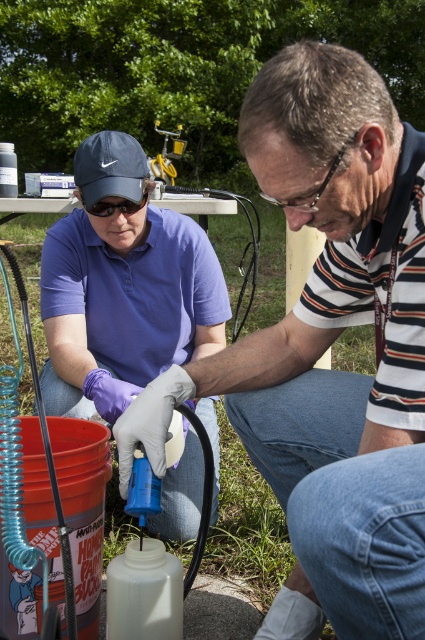
Which is behind, point (391, 195) or point (156, 244)?

Positioned behind is point (156, 244).

Is white matte glove at lower left taller than purple fabric shirt at center?

No.

Is point (397, 195) behind point (187, 516)?

That is False.

Identify the location of white matte glove at lower left. The image size is (425, 640). (331, 371).

Is point (107, 266) farther from viewer compared to point (133, 204)?

That is True.

Who is more distant from viewer, (76, 156) or (105, 212)?

The point (105, 212) is more distant.

Does point (85, 241) come behind point (142, 195)?

Yes.

This screenshot has width=425, height=640. Identify the location of purple fabric shirt at center. (122, 288).

Is the position of white matte glove at lower left less distant than that of clear plastic goggles at center?

That is True.

Is white matte glove at lower left taller than clear plastic goggles at center?

Yes, white matte glove at lower left is taller than clear plastic goggles at center.

Is point (317, 564) positioned before point (308, 198)?

Yes, it is in front of point (308, 198).

This screenshot has height=640, width=425. I want to click on white matte glove at lower left, so click(331, 371).